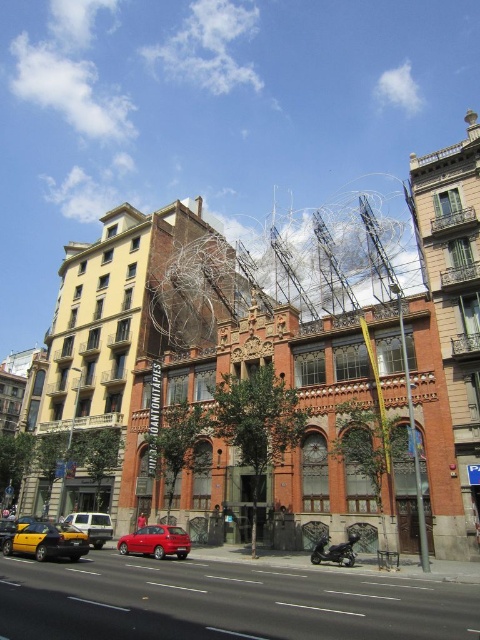
Question: Is the position of shiny red sedan at center less distant than that of matte silver van at center?

Choices:
 (A) no
 (B) yes

Answer: (B)

Question: Is the position of yellow matte taxi at lower left more distant than that of shiny red sedan at center?

Choices:
 (A) yes
 (B) no

Answer: (B)

Question: Does yellow matte taxi at lower left appear on the left side of matte silver van at center?

Choices:
 (A) yes
 (B) no

Answer: (B)

Question: Which object is positioned farthest from the shiny red sedan at center?

Choices:
 (A) yellow matte taxi at lower left
 (B) matte silver van at center

Answer: (A)

Question: Which object is closer to the camera taking this photo?

Choices:
 (A) yellow matte taxi at lower left
 (B) shiny red sedan at center

Answer: (A)

Question: Among these objects, which one is nearest to the camera?

Choices:
 (A) matte silver van at center
 (B) shiny red sedan at center

Answer: (B)